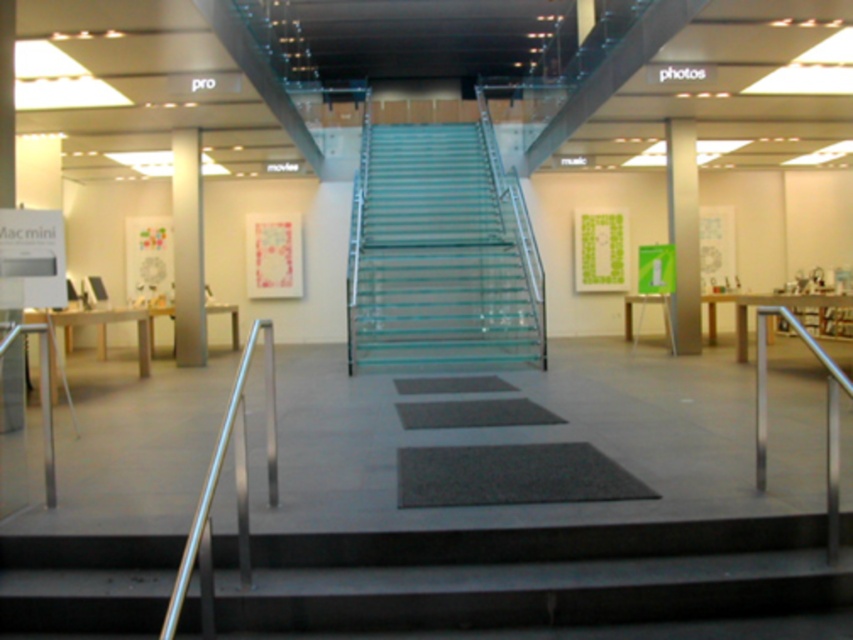
Can you confirm if metallic gray stairs at center is smaller than transparent glass stairs at center?

No, metallic gray stairs at center is not smaller than transparent glass stairs at center.

Does metallic gray stairs at center appear over transparent glass stairs at center?

Actually, metallic gray stairs at center is below transparent glass stairs at center.

Does point (305, 620) lie behind point (480, 150)?

That is False.

At what (x,y) coordinates should I click in order to perform the action: click on metallic gray stairs at center. Please return your answer as a coordinate pair (x, y). The width and height of the screenshot is (853, 640). Looking at the image, I should click on [x=544, y=580].

Is metallic gray stairs at center positioned before black rubber mat at center?

That is True.

Between metallic gray stairs at center and black rubber mat at center, which one appears on the left side from the viewer's perspective?

metallic gray stairs at center is more to the left.

Between point (432, 564) and point (598, 484), which one is positioned behind?

The point (598, 484) is more distant.

In order to click on metallic gray stairs at center in this screenshot , I will do `click(544, 580)`.

The width and height of the screenshot is (853, 640). Find the location of `silver metallic pillar at right`. silver metallic pillar at right is located at coordinates (683, 234).

Is point (698, 316) closer to viewer compared to point (834, 385)?

No, it is not.

Is point (666, 154) positioned before point (756, 324)?

Yes, point (666, 154) is closer to viewer.

You are a GUI agent. You are given a task and a screenshot of the screen. Output one action in this format:
    pyautogui.click(x=<x>, y=<y>)
    Task: Click on the silver metallic pillar at right
    This screenshot has width=853, height=640.
    Given the screenshot: What is the action you would take?
    pyautogui.click(x=683, y=234)